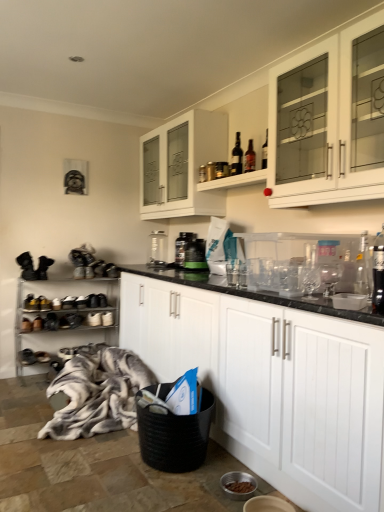
Question: Is dark glass bottle at upper center, marked as the 2th bottle in a front-to-back arrangement, shorter than matte glass bottles at upper center, positioned as the second shelf in left-to-right order?

Choices:
 (A) yes
 (B) no

Answer: (B)

Question: Is dark glass bottle at upper center, the first bottle in the back-to-front sequence, positioned before matte glass bottles at upper center, which ranks as the second shelf in back-to-front order?

Choices:
 (A) yes
 (B) no

Answer: (B)

Question: Is dark glass bottle at upper center, which is counted as the first bottle, starting from the top, facing towards matte glass bottles at upper center, positioned as the first shelf in right-to-left order?

Choices:
 (A) yes
 (B) no

Answer: (B)

Question: Does dark glass bottle at upper center, acting as the second bottle starting from the bottom, have a larger size compared to matte glass bottles at upper center, the first shelf in the top-to-bottom sequence?

Choices:
 (A) no
 (B) yes

Answer: (A)

Question: Does dark glass bottle at upper center, acting as the second bottle starting from the bottom, have a greater height compared to matte glass bottles at upper center, marked as the 1th shelf in a front-to-back arrangement?

Choices:
 (A) no
 (B) yes

Answer: (B)

Question: Considering the positions of point (142, 184) and point (236, 176), is point (142, 184) closer or farther from the camera than point (236, 176)?

Choices:
 (A) farther
 (B) closer

Answer: (A)

Question: Looking at their shapes, would you say white glass cabinet at upper center, which ranks as the 1th cabinetry in top-to-bottom order, is wider or thinner than matte glass bottles at upper center, positioned as the first shelf in right-to-left order?

Choices:
 (A) wide
 (B) thin

Answer: (A)

Question: From a real-world perspective, is white glass cabinet at upper center, which ranks as the 1th cabinetry in top-to-bottom order, positioned above or below matte glass bottles at upper center, positioned as the first shelf in right-to-left order?

Choices:
 (A) above
 (B) below

Answer: (A)

Question: From the image's perspective, is white glass cabinet at upper center, which ranks as the 1th cabinetry in top-to-bottom order, above or below matte glass bottles at upper center, positioned as the second shelf in left-to-right order?

Choices:
 (A) above
 (B) below

Answer: (A)

Question: In the image, is white glass cabinet at upper right, the second cabinetry positioned from the top, positioned in front of or behind metallic silver shoe rack at left, which is the first shelf from bottom to top?

Choices:
 (A) behind
 (B) front

Answer: (B)

Question: In terms of height, does white glass cabinet at upper right, the second cabinetry positioned from the top, look taller or shorter compared to metallic silver shoe rack at left, the second shelf from the right?

Choices:
 (A) tall
 (B) short

Answer: (B)

Question: Visually, is white glass cabinet at upper right, the second cabinetry positioned from the top, positioned to the left or to the right of metallic silver shoe rack at left, placed as the 1th shelf when sorted from left to right?

Choices:
 (A) left
 (B) right

Answer: (B)

Question: From the image's perspective, relative to metallic silver shoe rack at left, the second shelf from the right, is white glass cabinet at upper right, which ranks as the second cabinetry in bottom-to-top order, above or below?

Choices:
 (A) above
 (B) below

Answer: (A)

Question: Is matte glass bottles at upper center, positioned as the first shelf in right-to-left order, in front of or behind metallic silver shoe rack at left, placed as the 1th shelf when sorted from left to right, in the image?

Choices:
 (A) behind
 (B) front

Answer: (B)

Question: Is point pyautogui.click(x=236, y=181) positioned closer to the camera than point pyautogui.click(x=112, y=320)?

Choices:
 (A) farther
 (B) closer

Answer: (B)